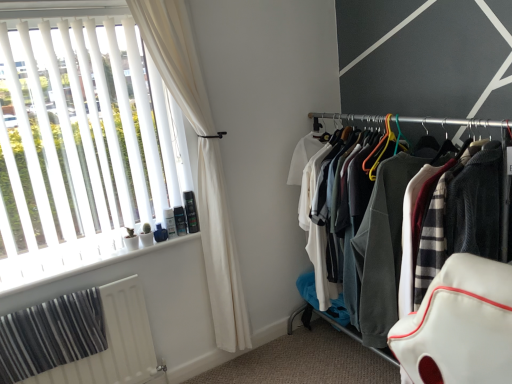
Where is `empty space that is ontop of white plastic window sill at lower left`? empty space that is ontop of white plastic window sill at lower left is located at coordinates (118, 253).